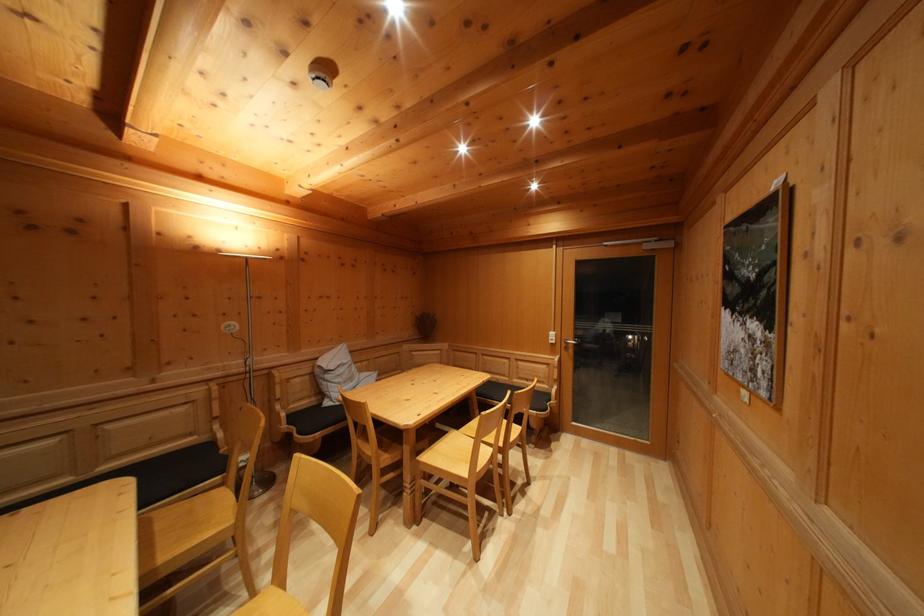
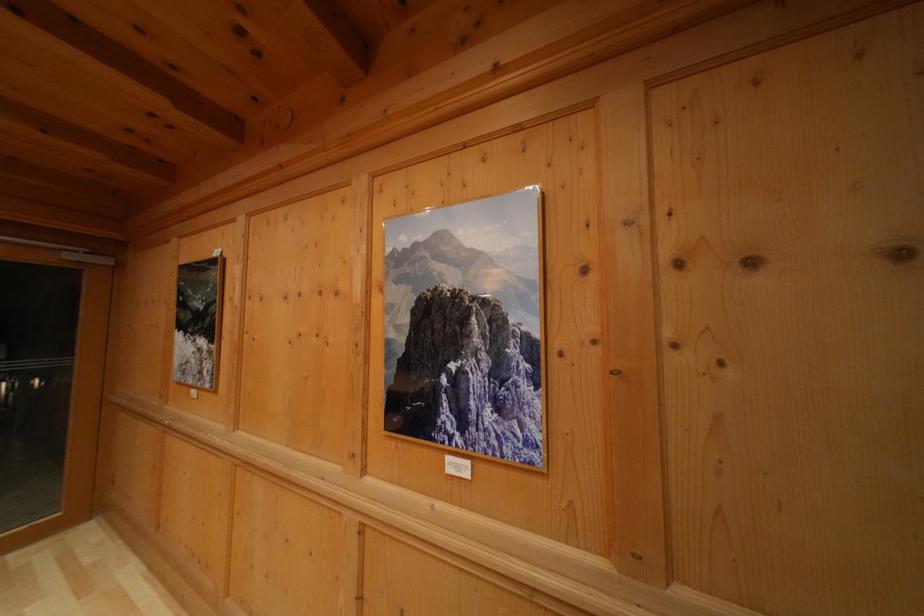
Question: Based on the continuous images, in which direction is the camera rotating? Reply with the corresponding letter.

Choices:
 (A) Left
 (B) Right
 (C) Up
 (D) Down

Answer: (B)